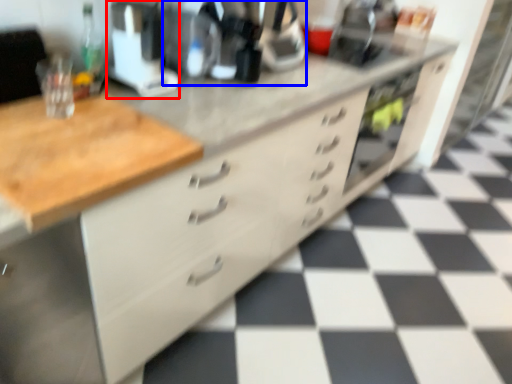
Question: Which point is further to the camera, appliance (highlighted by a red box) or coffee machine (highlighted by a blue box)?

Choices:
 (A) appliance
 (B) coffee machine

Answer: (B)